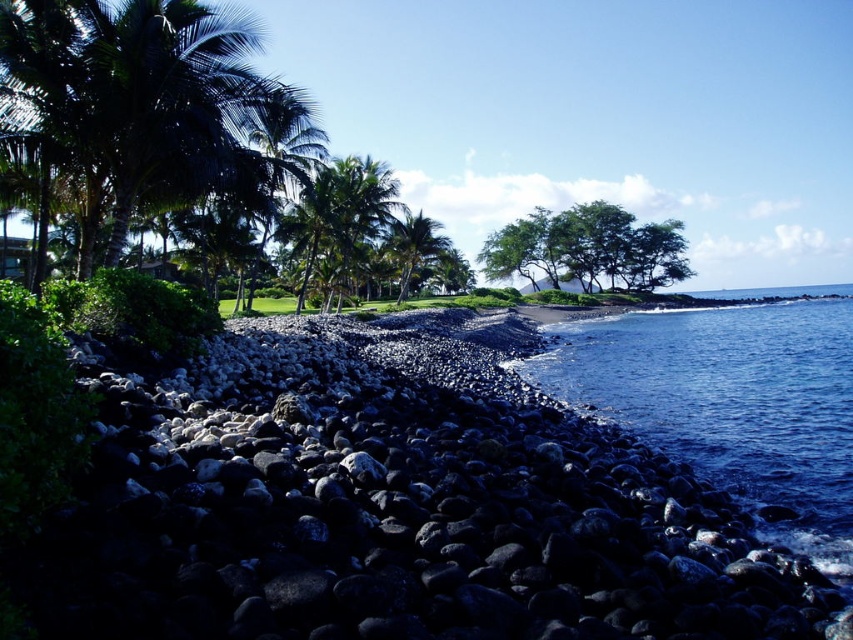
You are standing at the center of the rocky shoreline in the coastal scene. There is a point marked at coordinates [729,401]. What is the nearest object to this point?

The point at coordinates [729,401] is on dark blue water at lower right, so the nearest object to this point is the dark blue water at lower right.

You are standing on the rocky shoreline and want to walk towards the palm trees. Based on the image, which direction should you head to reach the green leafy palm tree at center from the black volcanic rocks at lower left?

Since the black volcanic rocks at lower left are positioned on the right side of the green leafy palm tree at center, you should head to the left to reach the green leafy palm tree at center from the black volcanic rocks at lower left.

You are standing at the edge of the rocky shoreline and want to walk towards the palm tree. Which direction should you move relative to the black volcanic rocks at lower left and the green leafy palm tree at center?

You should move upward from the black volcanic rocks at lower left towards the green leafy palm tree at center since the rocks are positioned below the palm tree.